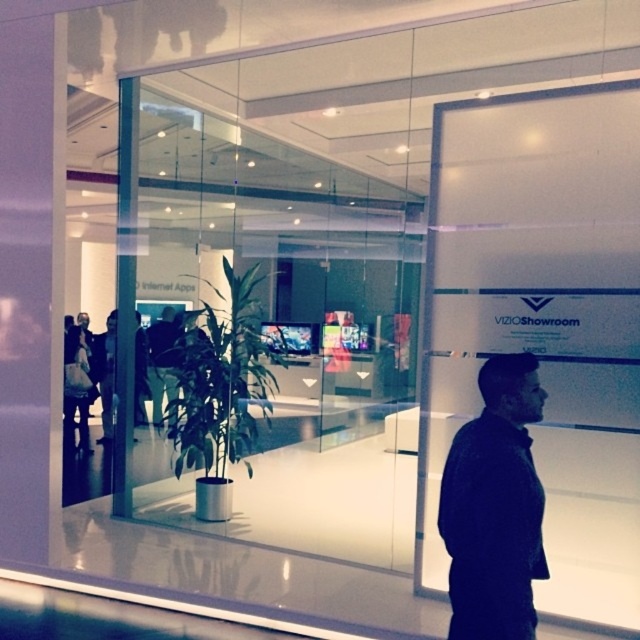
You are a customer standing outside the VIZIO Showroom looking in. You see a green leafy plant at center and a black leather jacket at center. Which object is closer to you through the glass?

The green leafy plant at center is closer to the viewer than the black leather jacket at center.

You are a customer in the VIZIO Showroom and you want to place a small accessory on the dark blue fabric at center or the black leather jacket at center. Which surface can accommodate it better?

The dark blue fabric at center occupies less space than the black leather jacket at center, so the black leather jacket at center can accommodate the small accessory better.